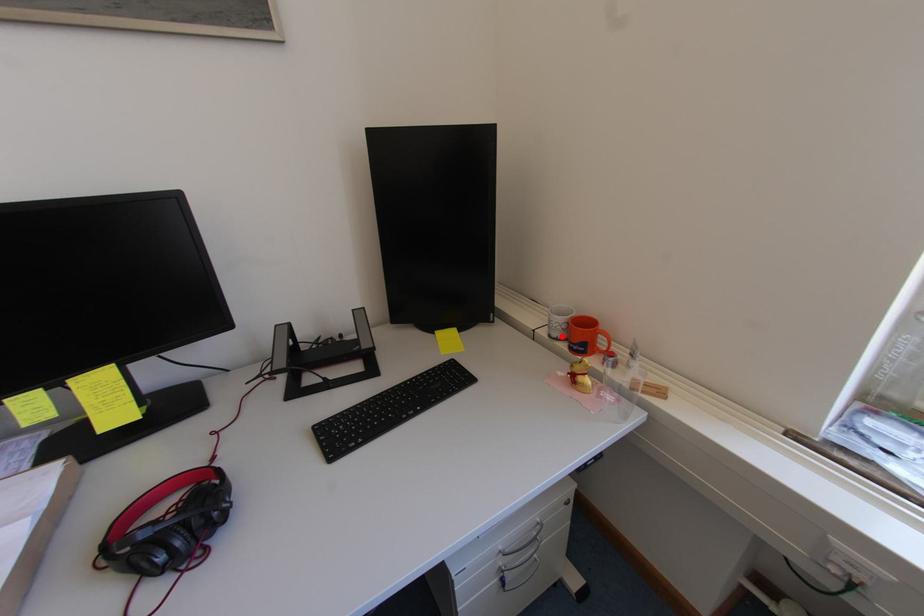
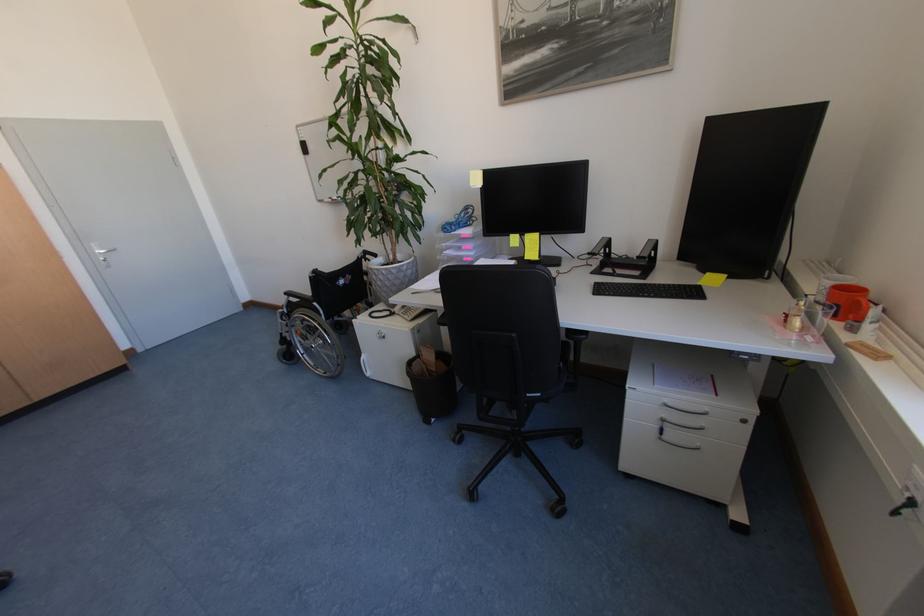
The point at the highlighted location is marked in the first image. Where is the corresponding point in the second image?

(824, 300)